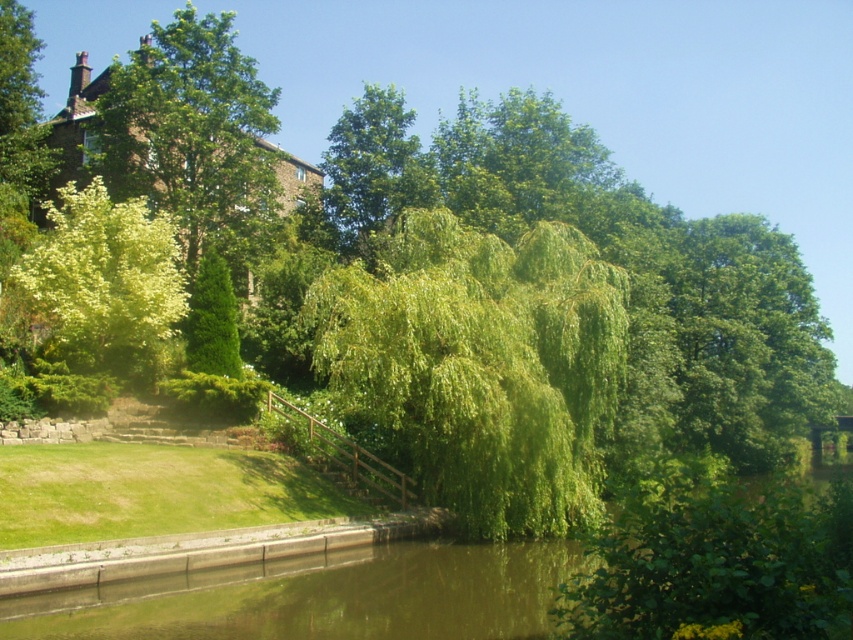
Is point (233, 166) farther from camera compared to point (91, 209)?

Yes.

Which is behind, point (263, 188) or point (84, 285)?

Positioned behind is point (263, 188).

At what (x,y) coordinates should I click in order to perform the action: click on green leafy tree at upper left. Please return your answer as a coordinate pair (x, y). Looking at the image, I should click on (193, 136).

Between green leafy willow at center and green leafy willow at left, which one has more height?

With more height is green leafy willow at center.

Image resolution: width=853 pixels, height=640 pixels. What do you see at coordinates (479, 365) in the screenshot?
I see `green leafy willow at center` at bounding box center [479, 365].

Does point (459, 305) come closer to viewer compared to point (184, 292)?

Yes, point (459, 305) is in front of point (184, 292).

At what (x,y) coordinates should I click in order to perform the action: click on green leafy willow at center. Please return your answer as a coordinate pair (x, y). Image resolution: width=853 pixels, height=640 pixels. Looking at the image, I should click on (479, 365).

In the scene shown: Can you confirm if green leafy willow at center is thinner than green leafy tree at upper left?

Indeed, green leafy willow at center has a lesser width compared to green leafy tree at upper left.

Which is more to the right, green leafy willow at center or green leafy tree at upper left?

green leafy willow at center is more to the right.

Between point (451, 364) and point (225, 83), which one is positioned in front?

Positioned in front is point (451, 364).

Find the location of a particular element. The width and height of the screenshot is (853, 640). green leafy willow at center is located at coordinates (479, 365).